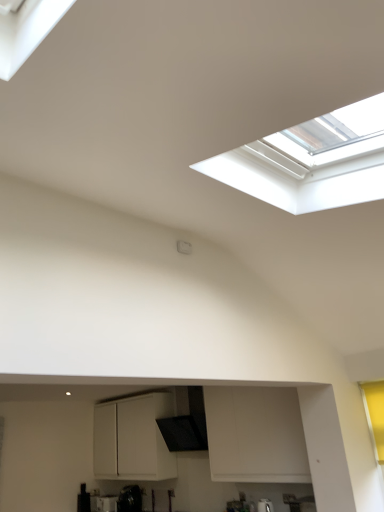
Question: Is white matte cabinet at center at the left side of black textured exhaust hood at center?

Choices:
 (A) yes
 (B) no

Answer: (A)

Question: From the image's perspective, is white matte cabinet at center above black textured exhaust hood at center?

Choices:
 (A) yes
 (B) no

Answer: (B)

Question: Is black textured exhaust hood at center surrounded by white matte cabinet at center?

Choices:
 (A) yes
 (B) no

Answer: (B)

Question: Can we say white matte cabinet at center lies outside black textured exhaust hood at center?

Choices:
 (A) no
 (B) yes

Answer: (B)

Question: Is white matte cabinet at center facing towards black textured exhaust hood at center?

Choices:
 (A) no
 (B) yes

Answer: (A)

Question: Is there a large distance between white matte cabinet at center and black textured exhaust hood at center?

Choices:
 (A) yes
 (B) no

Answer: (B)

Question: Can you confirm if black textured exhaust hood at center is wider than white matte cabinet at center?

Choices:
 (A) yes
 (B) no

Answer: (B)

Question: From the image's perspective, is black textured exhaust hood at center located above white matte cabinet at center?

Choices:
 (A) no
 (B) yes

Answer: (B)

Question: Considering the relative positions of black textured exhaust hood at center and white matte cabinet at center in the image provided, is black textured exhaust hood at center behind white matte cabinet at center?

Choices:
 (A) yes
 (B) no

Answer: (B)

Question: Does black textured exhaust hood at center have a lesser height compared to white matte cabinet at center?

Choices:
 (A) yes
 (B) no

Answer: (A)

Question: Considering the relative sizes of black textured exhaust hood at center and white matte cabinet at center in the image provided, is black textured exhaust hood at center taller than white matte cabinet at center?

Choices:
 (A) yes
 (B) no

Answer: (B)

Question: From a real-world perspective, does black textured exhaust hood at center sit lower than white matte cabinet at center?

Choices:
 (A) no
 (B) yes

Answer: (A)

Question: Is white matte cabinet at center positioned with its back to black glossy kettle at lower center?

Choices:
 (A) no
 (B) yes

Answer: (A)